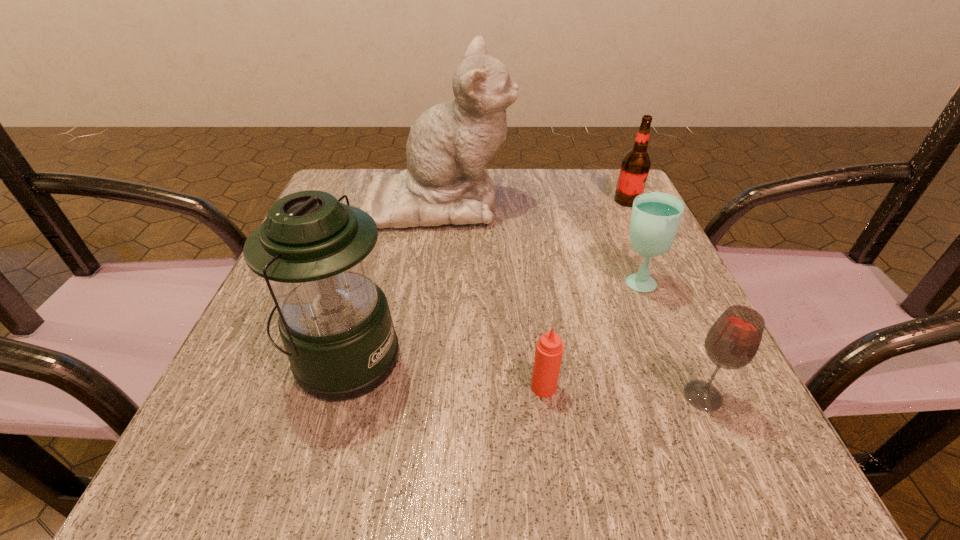
In the image, there is a desktop. Where is `vacant region at the near edge`? This screenshot has width=960, height=540. vacant region at the near edge is located at coordinates (329, 429).

The image size is (960, 540). Identify the location of free space at the left edge of the desktop. [243, 343].

The width and height of the screenshot is (960, 540). What are the coordinates of `vacant region at the right edge` in the screenshot? It's located at (608, 233).

The height and width of the screenshot is (540, 960). What are the coordinates of `vacant space at the far left corner of the desktop` in the screenshot? It's located at (379, 170).

In the image, there is a desktop. Where is `vacant space at the far right corner`? vacant space at the far right corner is located at coordinates (603, 218).

In the image, there is a desktop. Identify the location of free region at the near right corner. (659, 459).

At what (x,y) coordinates should I click in order to perform the action: click on unoccupied area between the nearer glass drink container and the shortest object. Please return your answer as a coordinate pair (x, y). The width and height of the screenshot is (960, 540). Looking at the image, I should click on (623, 392).

The height and width of the screenshot is (540, 960). Identify the location of free space between the nearer glass drink container and the farther glass drink container. (669, 339).

You are a GUI agent. You are given a task and a screenshot of the screen. Output one action in this format:
    pyautogui.click(x=<x>, y=<y>)
    Task: Click on the vacant region between the Tabasco sauce and the second tallest object
    This screenshot has width=960, height=540.
    Given the screenshot: What is the action you would take?
    pyautogui.click(x=444, y=373)

The image size is (960, 540). Identify the location of free space between the root beer and the tallest object. (533, 201).